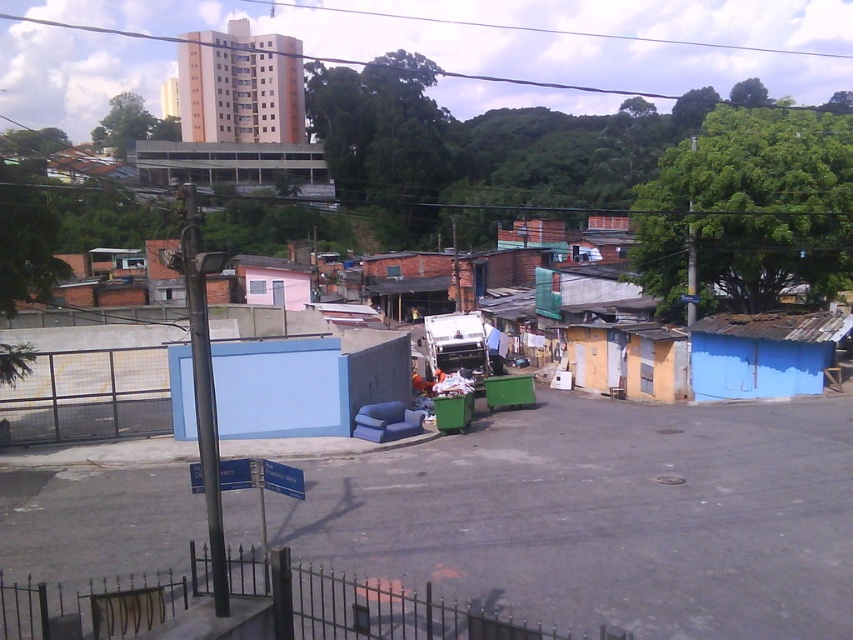
Who is higher up, blue corrugated metal hut at right or green corrugated metal building at upper center?

green corrugated metal building at upper center is higher up.

Does blue corrugated metal hut at right have a smaller size compared to green corrugated metal building at upper center?

Correct, blue corrugated metal hut at right occupies less space than green corrugated metal building at upper center.

Is point (822, 333) positioned in front of point (151, 154)?

That is True.

The width and height of the screenshot is (853, 640). What are the coordinates of `blue corrugated metal hut at right` in the screenshot? It's located at (x=762, y=353).

Which is above, beige concrete building at upper left or green corrugated metal building at upper center?

beige concrete building at upper left is above.

Locate an element on the screen. This screenshot has height=640, width=853. beige concrete building at upper left is located at coordinates tap(241, 86).

Where is `beige concrete building at upper left`? The image size is (853, 640). beige concrete building at upper left is located at coordinates (241, 86).

Who is positioned more to the left, beige concrete building at upper left or blue corrugated metal hut at right?

Positioned to the left is beige concrete building at upper left.

Describe the element at coordinates (241, 86) in the screenshot. I see `beige concrete building at upper left` at that location.

Does point (293, 42) come behind point (701, 358)?

Yes, point (293, 42) is behind point (701, 358).

Locate an element on the screen. beige concrete building at upper left is located at coordinates (241, 86).